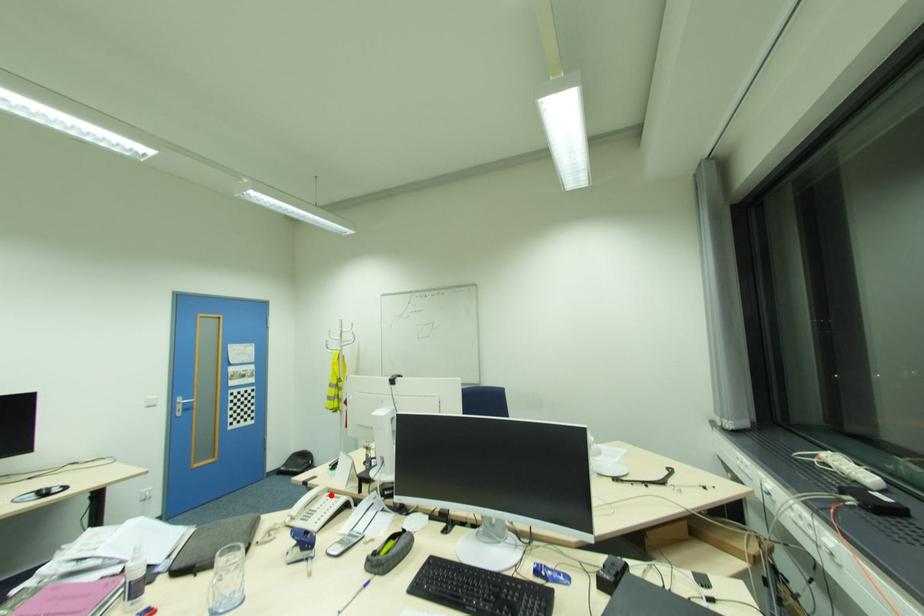
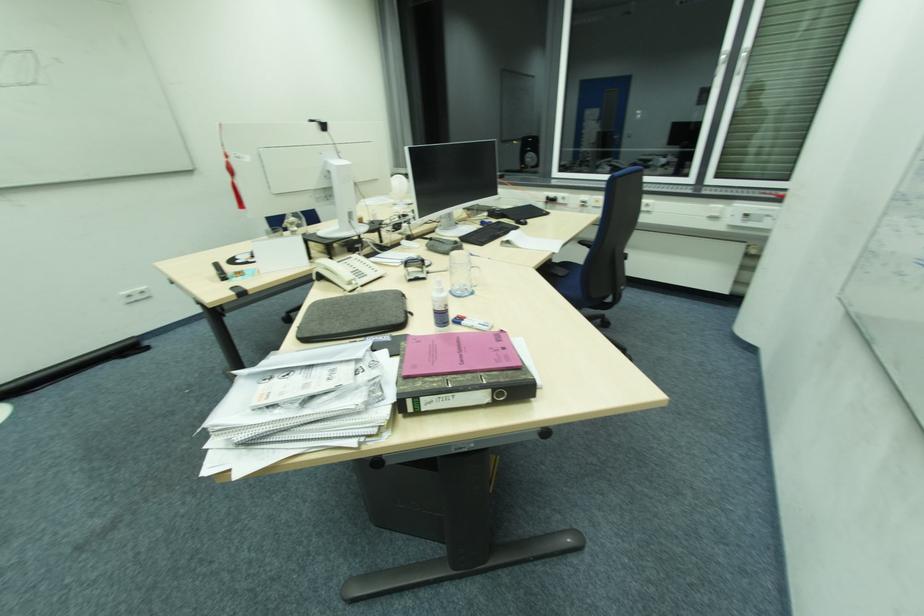
Locate, in the second image, the point that corresponds to the highlighted location in the first image.

(342, 262)